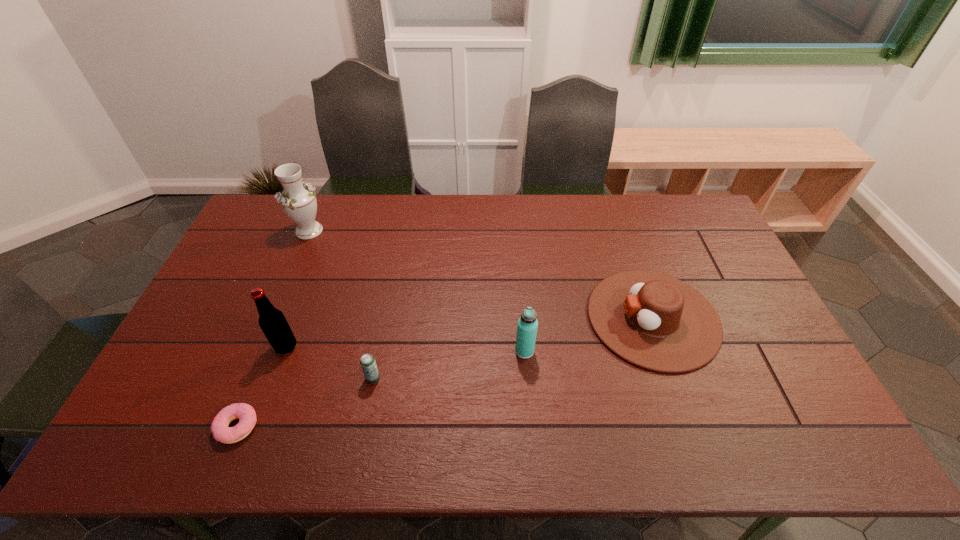
Locate an element on the screen. The height and width of the screenshot is (540, 960). free space between the doughnut and the beer bottle is located at coordinates 261,387.

This screenshot has width=960, height=540. Identify the location of vacant area between the fifth object from left to right and the beer can. (448, 364).

The height and width of the screenshot is (540, 960). In order to click on vacant point located between the doughnut and the beer bottle in this screenshot , I will do `click(261, 387)`.

I want to click on free space between the nearest object and the cowboy hat, so click(445, 372).

You are a GUI agent. You are given a task and a screenshot of the screen. Output one action in this format:
    pyautogui.click(x=<x>, y=<y>)
    Task: Click on the empty space between the rightmost object and the fourth object from left to right
    Image resolution: width=960 pixels, height=540 pixels.
    Given the screenshot: What is the action you would take?
    pyautogui.click(x=513, y=348)

Identify the location of free spot between the fourth shortest object and the beer bottle. This screenshot has width=960, height=540. [x=405, y=349].

Select which object appears as the fourth closest to the third object from right to left. Please provide its 2D coordinates. Your answer should be formatted as a tuple, i.e. [(x, y)], where the tuple contains the x and y coordinates of a point satisfying the conditions above.

[(298, 201)]

Locate an element on the screen. object identified as the fourth closest to the beer bottle is located at coordinates (527, 325).

You are a GUI agent. You are given a task and a screenshot of the screen. Output one action in this format:
    pyautogui.click(x=<x>, y=<y>)
    Task: Click on the vacant space that satisfies the following two spatial constraints: 1. on the front side of the beer can; 2. on the left side of the beer bottle
    The height and width of the screenshot is (540, 960).
    Given the screenshot: What is the action you would take?
    pyautogui.click(x=275, y=379)

Identify the location of blank area in the image that satisfies the following two spatial constraints: 1. on the front side of the vase; 2. on the right side of the nearest object. The height and width of the screenshot is (540, 960). (228, 427).